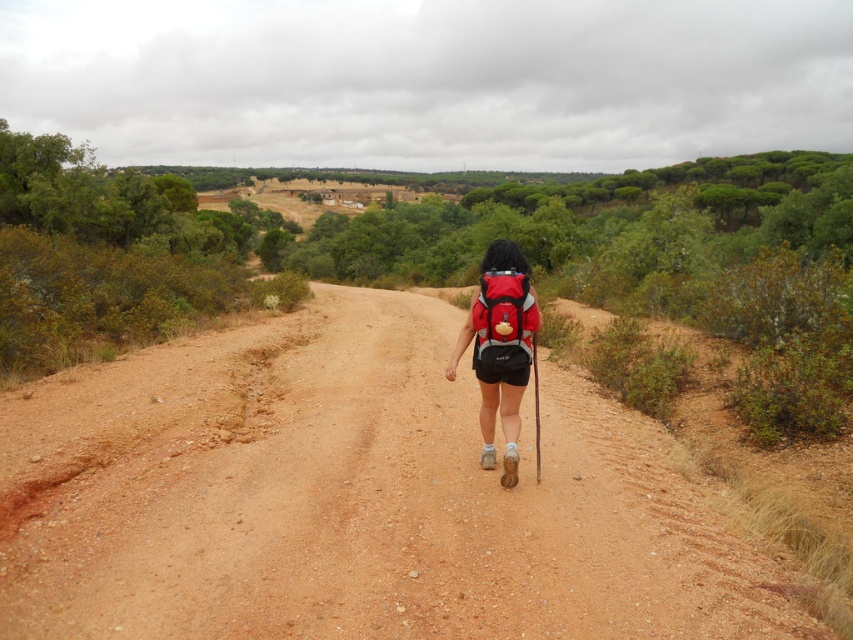
You are a hiker trying to decide whether to place your matte red backpack at center on the brown dirt track at center. Considering the height of the track, will the backpack be stable?

The brown dirt track at center is not as tall as the matte red backpack at center, so the backpack will be stable since it is taller than the track.

You are a hiker trying to follow the path correctly. You see two points marked on your map at coordinates point [403,600] and point [494,282]. Which point should you head towards first to stay on the path?

You should head towards point [403,600] first because it is in front of point [494,282] along the path.

From the picture: You are a hiker with a 2.5 meter long tent pole. You need to carry it while walking along the brown dirt track at center. The tent pole is rigid and cannot be folded. Can you walk along the path while carrying the tent pole horizontally without it touching the red fabric backpack at center?

The distance between the brown dirt track at center and the red fabric backpack at center is 2.48 meters. Since the tent pole is 2.5 meters long, it would extend slightly beyond the space available, making it difficult to carry horizontally without touching the backpack.